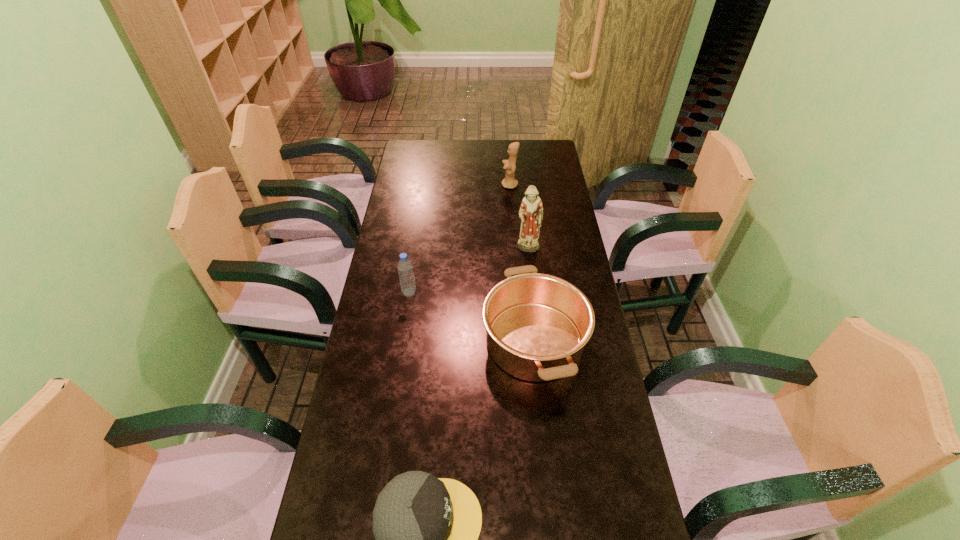
Locate an element on the screen. The image size is (960, 540). vacant space located 0.070m on the right of the bottle is located at coordinates (438, 292).

I want to click on vacant space located on the back of the saucepan, so click(x=522, y=226).

Image resolution: width=960 pixels, height=540 pixels. In order to click on object that is positioned at the left edge in this screenshot , I will do `click(405, 268)`.

Find the location of a particular element. Image resolution: width=960 pixels, height=540 pixels. figurine that is at the right edge is located at coordinates (531, 210).

I want to click on saucepan that is positioned at the right edge, so click(x=537, y=325).

I want to click on free space at the far edge of the desktop, so click(495, 142).

I want to click on vacant space at the left edge of the desktop, so click(x=422, y=199).

Where is `vacant space at the right edge of the desktop`? The height and width of the screenshot is (540, 960). vacant space at the right edge of the desktop is located at coordinates [x=562, y=185].

Locate an element on the screen. free region at the far right corner of the desktop is located at coordinates (535, 165).

You are a GUI agent. You are given a task and a screenshot of the screen. Output one action in this format:
    pyautogui.click(x=<x>, y=<y>)
    Task: Click on the free point between the bottle and the fourth shortest object
    
    Given the screenshot: What is the action you would take?
    pyautogui.click(x=460, y=239)